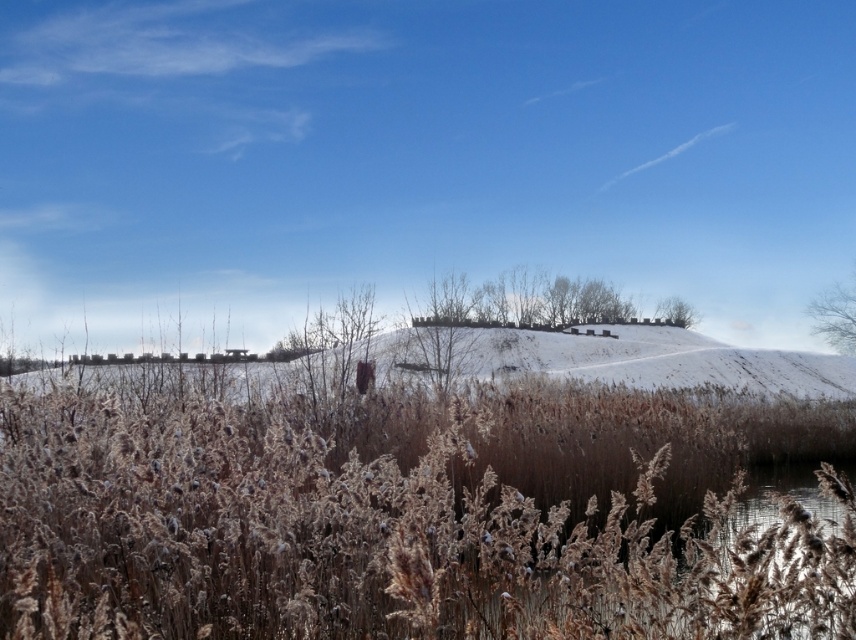
Question: Which object is farther from the camera taking this photo?

Choices:
 (A) bare branches at upper right
 (B) green leafy tree at upper center

Answer: (B)

Question: Which of the following is the farthest from the observer?

Choices:
 (A) (818, 298)
 (B) (657, 310)

Answer: (B)

Question: Is bare branches at upper right below green leafy tree at upper center?

Choices:
 (A) no
 (B) yes

Answer: (B)

Question: Can you confirm if bare branches at upper right is smaller than green leafy tree at upper center?

Choices:
 (A) no
 (B) yes

Answer: (B)

Question: Where is bare branches at upper right located in relation to green leafy tree at upper center in the image?

Choices:
 (A) left
 (B) right

Answer: (B)